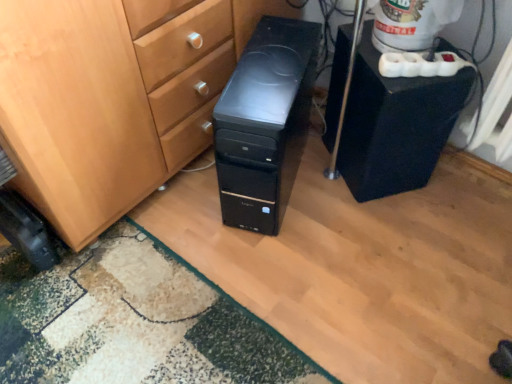
Identify the location of vacant space in between black plastic computer tower at center and black plastic speaker at right. The height and width of the screenshot is (384, 512). (323, 193).